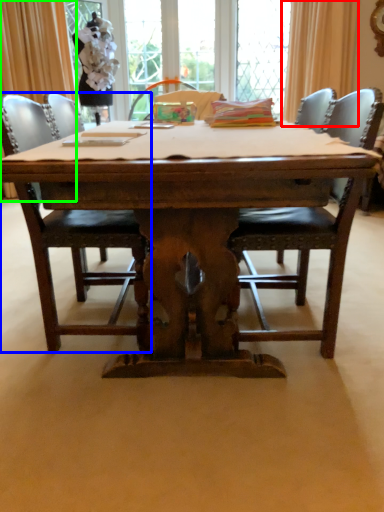
Question: Which object is positioned farthest from curtain (highlighted by a red box)? Select from chair (highlighted by a blue box) and curtain (highlighted by a green box).

Choices:
 (A) chair
 (B) curtain

Answer: (A)